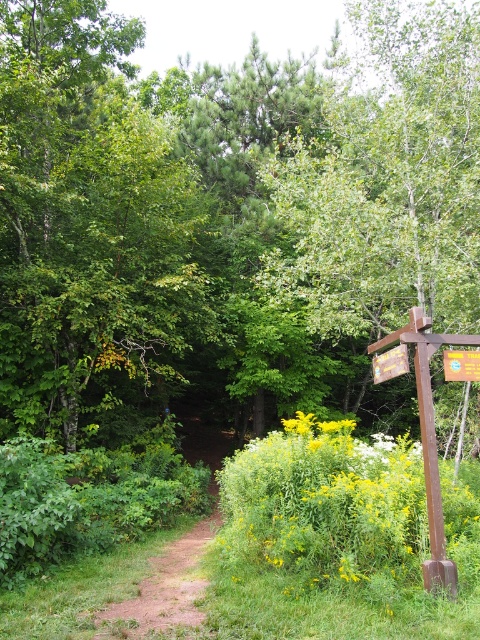
Can you confirm if yellow plastic sign at right is positioned to the left of wooden sign at right?

No, yellow plastic sign at right is not to the left of wooden sign at right.

Does point (456, 355) lie behind point (404, 360)?

Yes.

Is point (466, 378) farther from camera compared to point (388, 355)?

No, (466, 378) is closer to viewer.

You are a GUI agent. You are given a task and a screenshot of the screen. Output one action in this format:
    pyautogui.click(x=<x>, y=<y>)
    Task: Click on the yellow plastic sign at right
    
    Given the screenshot: What is the action you would take?
    pyautogui.click(x=462, y=364)

Where is `dirt path at center`? Image resolution: width=480 pixels, height=640 pixels. dirt path at center is located at coordinates (163, 589).

Who is positioned more to the left, dirt path at center or wooden signpost at right?

dirt path at center is more to the left.

Does point (190, 540) come closer to viewer compared to point (444, 582)?

That is False.

At what (x,y) coordinates should I click in order to perform the action: click on dirt path at center. Please return your answer as a coordinate pair (x, y). The image size is (480, 640). Looking at the image, I should click on (163, 589).

The height and width of the screenshot is (640, 480). What do you see at coordinates (429, 436) in the screenshot? I see `wooden signpost at right` at bounding box center [429, 436].

Does wooden signpost at right have a greater height compared to wooden sign at right?

Indeed, wooden signpost at right has a greater height compared to wooden sign at right.

Is point (430, 467) closer to viewer compared to point (393, 364)?

Yes, point (430, 467) is in front of point (393, 364).

Where is `wooden signpost at right`? The height and width of the screenshot is (640, 480). wooden signpost at right is located at coordinates (429, 436).